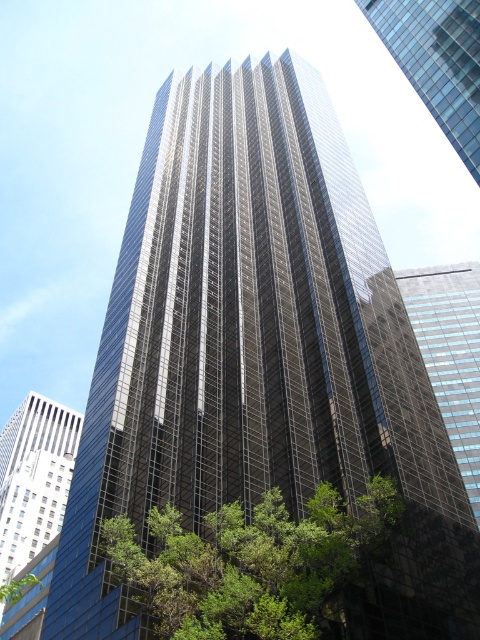
Who is more distant from viewer, [241,614] or [377,12]?

Point [377,12]

Is green leafy tree at center above glassy reflective skyscraper at upper right?

Actually, green leafy tree at center is below glassy reflective skyscraper at upper right.

Locate an element on the screen. Image resolution: width=480 pixels, height=640 pixels. green leafy tree at center is located at coordinates click(x=252, y=563).